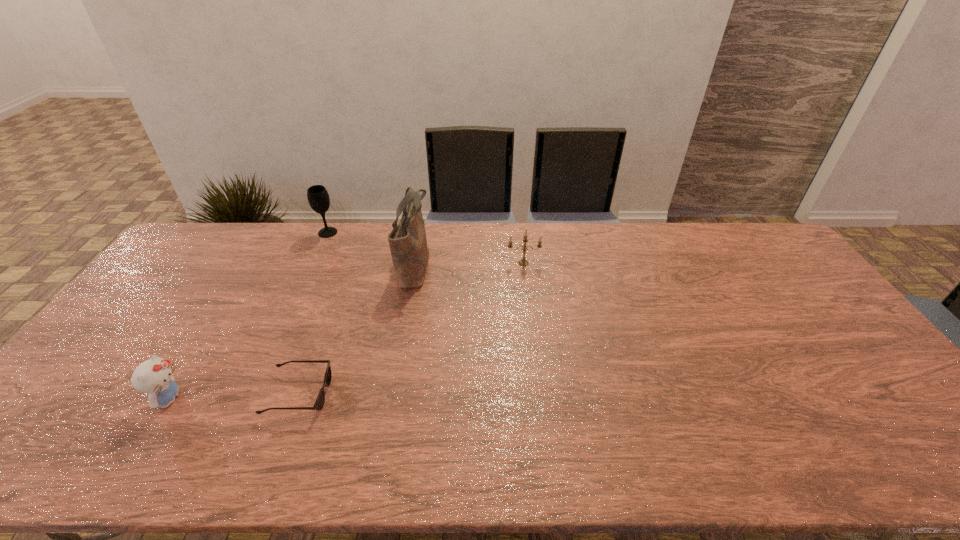
Where is `free space between the tallest object and the leftmost object`? Image resolution: width=960 pixels, height=540 pixels. free space between the tallest object and the leftmost object is located at coordinates (292, 332).

At what (x,y) coordinates should I click in order to perform the action: click on unoccupied position between the wineglass and the leftmost object. Please return your answer as a coordinate pair (x, y). The image size is (960, 540). Looking at the image, I should click on (249, 316).

Identify the location of free point between the candle and the shortest object. (411, 328).

This screenshot has width=960, height=540. Identify the location of vacant area that lies between the tallest object and the candle. (469, 264).

Identify the location of free area in between the fourth object from left to right and the wineglass. The height and width of the screenshot is (540, 960). (372, 249).

The image size is (960, 540). What are the coordinates of `free spot between the kitten and the farthest object` in the screenshot? It's located at (249, 316).

You are a GUI agent. You are given a task and a screenshot of the screen. Output one action in this format:
    pyautogui.click(x=<x>, y=<y>)
    Task: Click on the vacant space in between the candle and the leftmost object
    The height and width of the screenshot is (540, 960).
    Given the screenshot: What is the action you would take?
    pyautogui.click(x=347, y=331)

Locate an element on the screen. empty location between the tallest object and the second tallest object is located at coordinates (372, 249).

Identify which object is the nearest to the leftmost object. Please provide its 2D coordinates. Your answer should be formatted as a tuple, i.e. [(x, y)], where the tuple contains the x and y coordinates of a point satisfying the conditions above.

[(319, 403)]

Image resolution: width=960 pixels, height=540 pixels. Identify the location of object that is the closest one to the kitten. (319, 403).